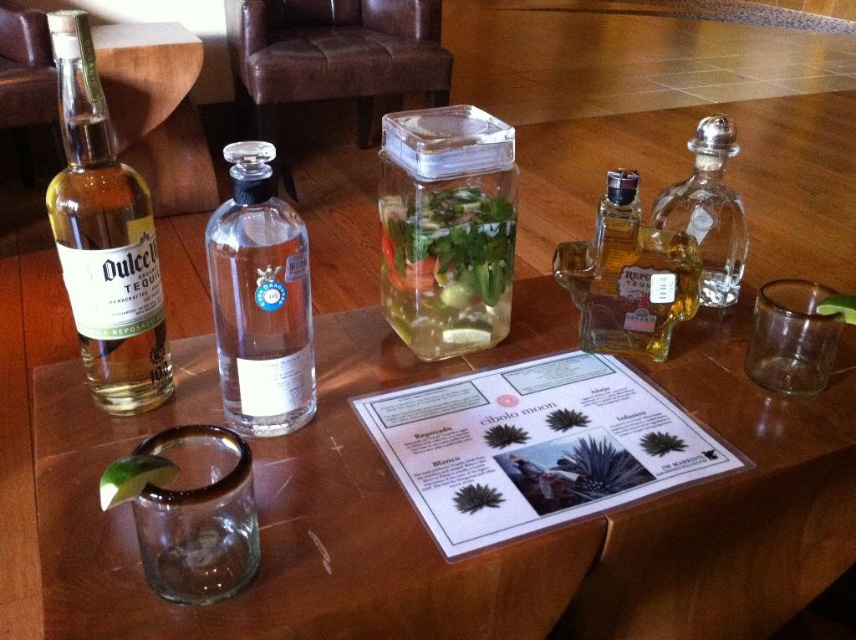
You are a guest at the tasting event and want to read the menu. Which clear glass item should you look at first, the clear glass menu at center or the clear glass container at center?

The clear glass menu at center is in front of the clear glass container at center, so you should look at the clear glass menu at center first.